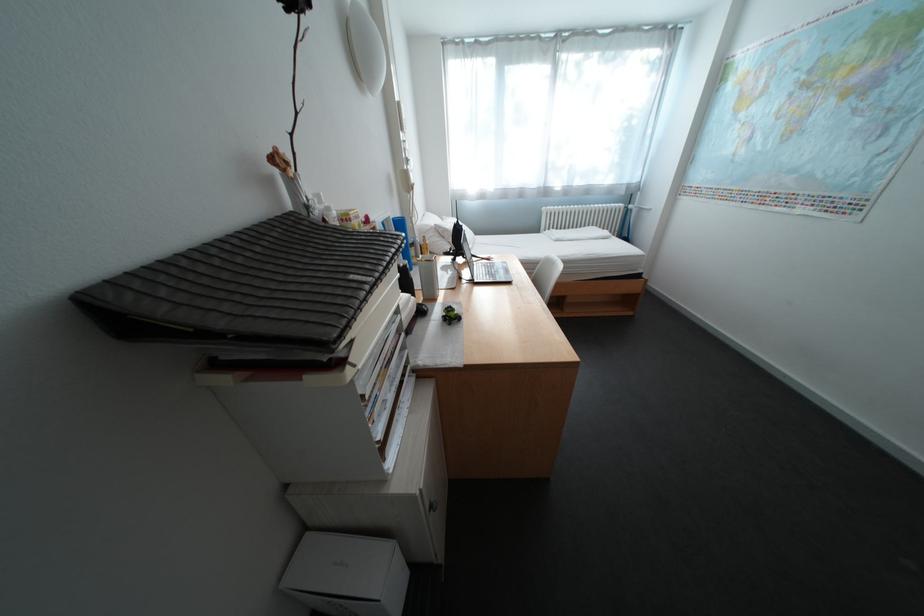
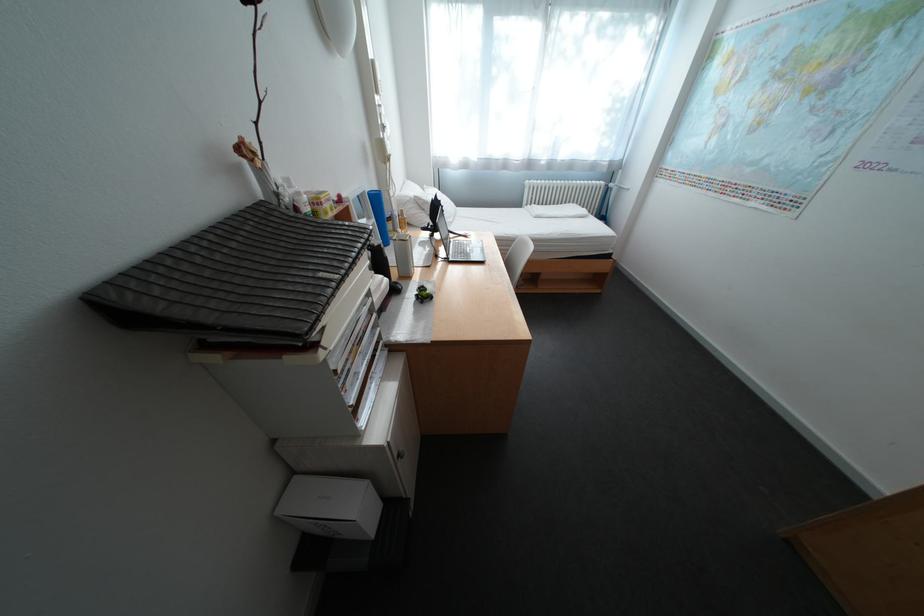
Find the pixel in the second image that matches point 442,228 in the first image.

(420, 200)